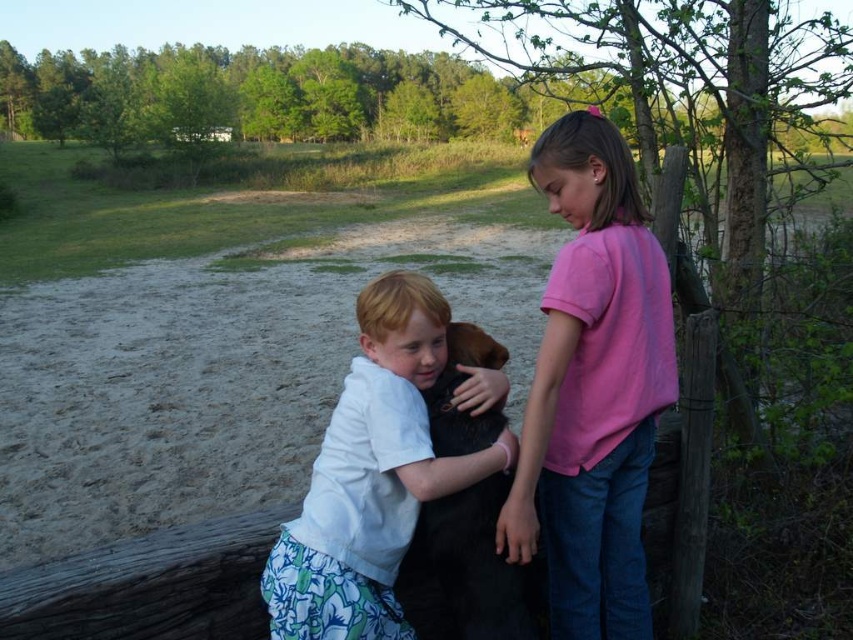
Between point (605, 353) and point (343, 445), which one is positioned behind?

The point (605, 353) is behind.

Who is positioned more to the left, pink cotton shirt at upper right or smooth white shirt at center?

smooth white shirt at center is more to the left.

Find the location of `pink cotton shirt at upper right`. pink cotton shirt at upper right is located at coordinates pyautogui.click(x=593, y=388).

The image size is (853, 640). Find the location of `pink cotton shirt at upper right`. pink cotton shirt at upper right is located at coordinates (593, 388).

Is smooth white shirt at center further to camera compared to black fur dog at center?

No, it is in front of black fur dog at center.

This screenshot has width=853, height=640. Find the location of `smooth white shirt at center`. smooth white shirt at center is located at coordinates (372, 476).

Identify the location of smooth white shirt at center. The height and width of the screenshot is (640, 853). (372, 476).

Can you confirm if pink cotton shirt at upper right is shorter than black fur dog at center?

In fact, pink cotton shirt at upper right may be taller than black fur dog at center.

Looking at this image, does pink cotton shirt at upper right come behind black fur dog at center?

Yes, it is behind black fur dog at center.

Where is `pink cotton shirt at upper right`? pink cotton shirt at upper right is located at coordinates (593, 388).

Locate an element on the screen. pink cotton shirt at upper right is located at coordinates (593, 388).